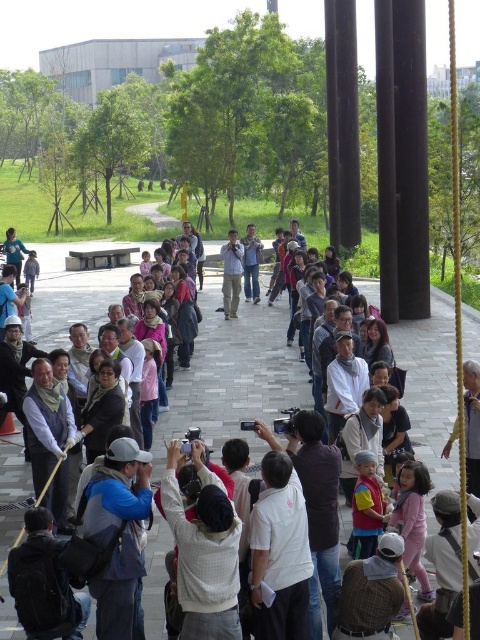
Question: Does white cotton shirt at center appear under light brown leather vest at center?

Choices:
 (A) no
 (B) yes

Answer: (B)

Question: Which of the following is the farthest from the observer?

Choices:
 (A) (111, 472)
 (B) (24, 410)
 (C) (308, 637)
 (D) (216, 621)

Answer: (B)

Question: Can you confirm if blue fabric backpack at center is bigger than light brown leather vest at center?

Choices:
 (A) yes
 (B) no

Answer: (B)

Question: Which point is farther from the camera taking this photo?

Choices:
 (A) (201, 612)
 (B) (34, 397)
 (C) (116, 634)

Answer: (B)

Question: Which point is farther to the camera?

Choices:
 (A) (300, 497)
 (B) (98, 609)
 (C) (31, 420)

Answer: (C)

Question: Does blue fabric backpack at center have a lesser width compared to light brown leather vest at center?

Choices:
 (A) no
 (B) yes

Answer: (A)